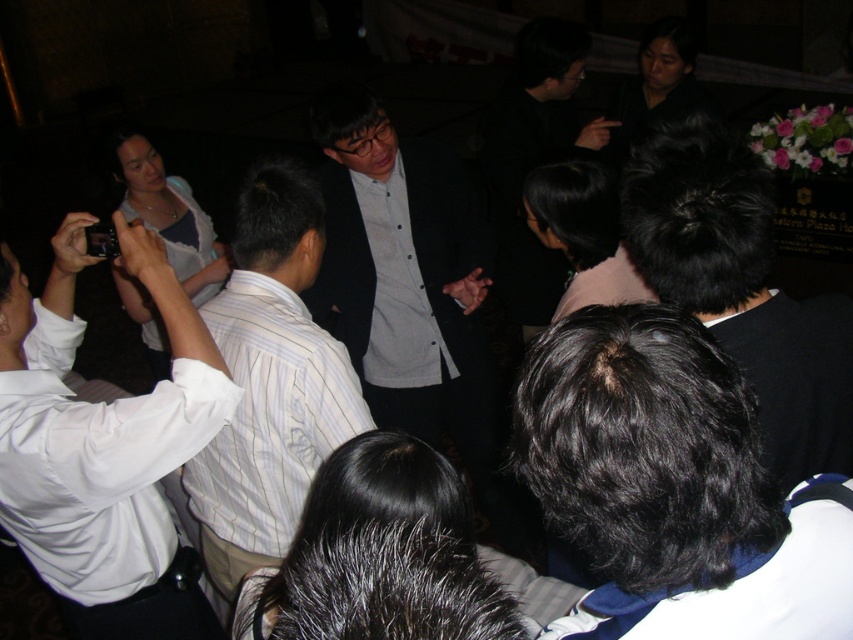
You are a photographer at a formal event. You need to capture a photo of the dark gray suit at center and the black hair at center. Which object should you focus on first if you want to ensure both are in focus?

The dark gray suit at center is located above black hair at center, so you should focus on the dark gray suit at center first to ensure both are in focus.

You are a photographer at the event and want to ensure both the white striped shirt at center and the black hair at center are clearly visible in your photo. Given their sizes, which object should you focus on first to ensure proper framing?

The white striped shirt at center is wider than the black hair at center, so focusing on the white striped shirt at center first will help ensure proper framing as it occupies more space in the image.

You are a photographer at this event and need to frame a photo of the dark gray suit at center and black hair at center. Which object is wider when viewed from your position?

The dark gray suit at center is wider than the black hair at center.